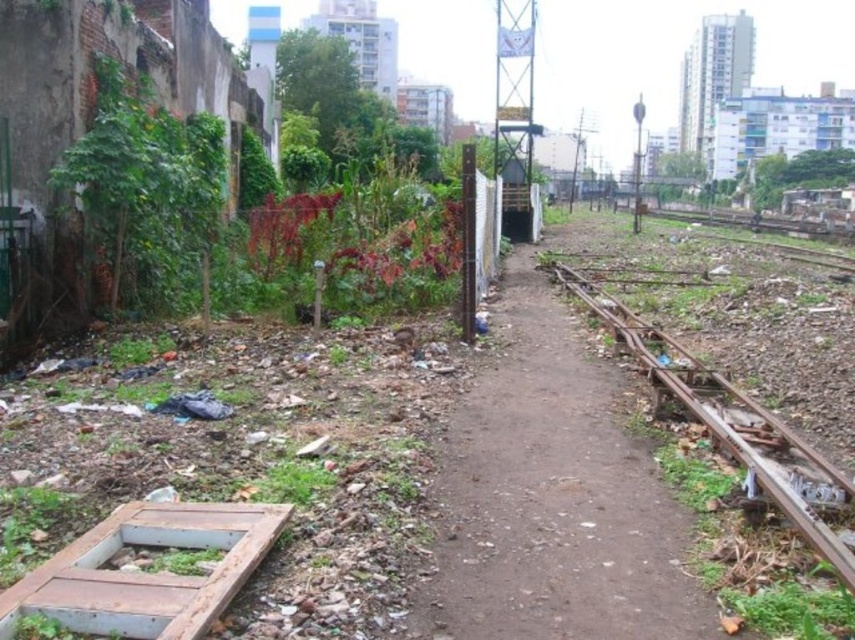
You are a delivery robot that is 18 inches wide. You need to navigate through the area shown in the image. Can you safely pass between the dirt path at center and the rusty metal train track at right without getting stuck?

The dirt path at center and the rusty metal train track at right are 18.30 inches apart. Since the robot is 18 inches wide, it can safely pass between them as there is enough space.

You are standing at the point labeled as point (x=551, y=497) in the image. What is the name of the feature you are currently standing on?

The point (x=551, y=497) indicates the dirt path at center.